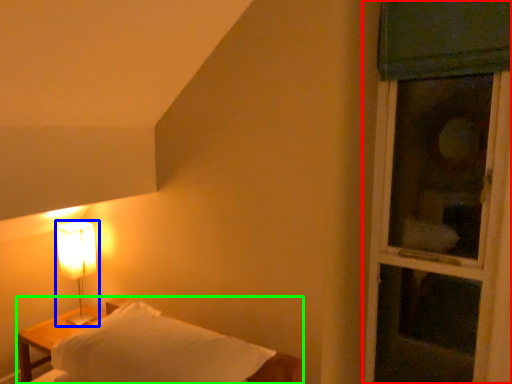
Question: Based on their relative distances, which object is farther from window (highlighted by a red box)? Choose from lamp (highlighted by a blue box) and furniture (highlighted by a green box).

Choices:
 (A) lamp
 (B) furniture

Answer: (A)